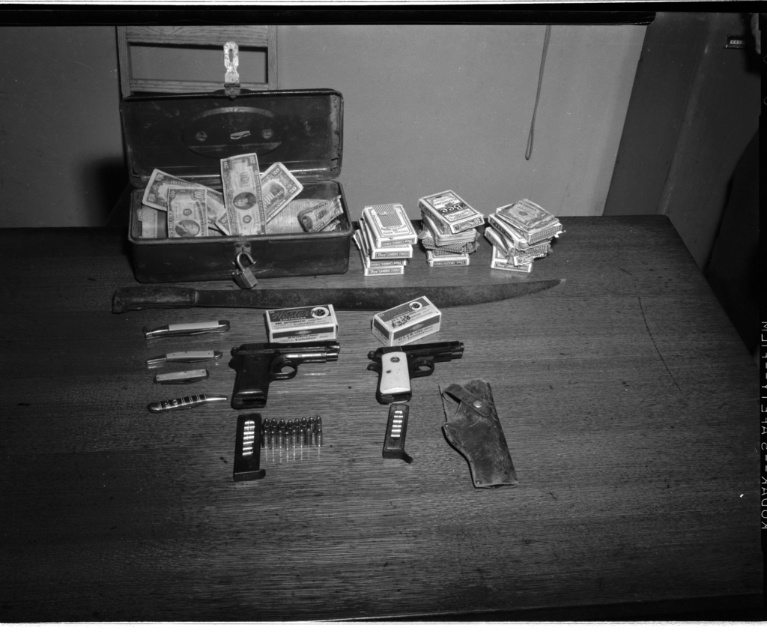
You are an investigator examining the evidence table. You need to determine if the metallic suitcase at upper center can be placed vertically in a storage locker that is 10 cm taller than the polished silver handgun at center. Is there enough vertical space?

The metallic suitcase at upper center is taller than the polished silver handgun at center. Since the locker is 10 cm taller than the handgun, the suitcase may not fit vertically if its height exceeds the combined height of the handgun plus 10 cm. However, without exact measurements, we cannot confirm. The description only states the suitcase is taller, but not by how much.

You are a detective examining the scene. You need to locate the metallic suitcase at upper center. Where exactly is it positioned in the image?

The metallic suitcase at upper center is located at point coordinates of [219,179].